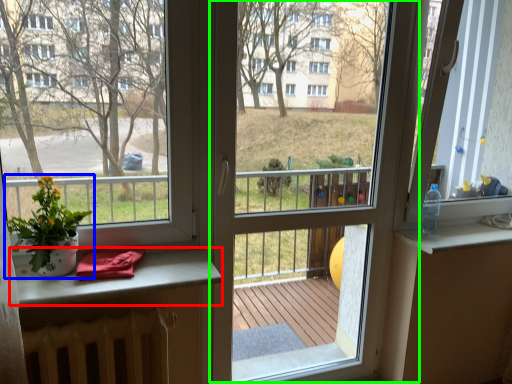
Question: Considering the real-world distances, which object is farthest from table (highlighted by a red box)? houseplant (highlighted by a blue box) or screen door (highlighted by a green box)?

Choices:
 (A) houseplant
 (B) screen door

Answer: (B)